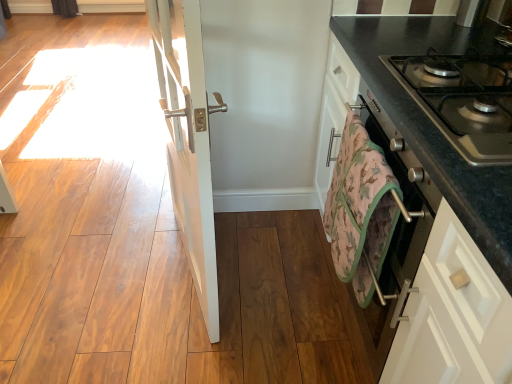
Question: Should I look upward or downward to see camouflage-patterned towel at lower right?

Choices:
 (A) up
 (B) down

Answer: (B)

Question: Considering the relative positions of white glossy door at center and black granite countertop at right in the image provided, is white glossy door at center to the left of black granite countertop at right from the viewer's perspective?

Choices:
 (A) yes
 (B) no

Answer: (A)

Question: Is white glossy door at center further to camera compared to black granite countertop at right?

Choices:
 (A) no
 (B) yes

Answer: (B)

Question: Is white glossy door at center to the right of black granite countertop at right from the viewer's perspective?

Choices:
 (A) yes
 (B) no

Answer: (B)

Question: Would you say black granite countertop at right is part of white glossy door at center's contents?

Choices:
 (A) no
 (B) yes

Answer: (A)

Question: Is white glossy door at center aimed at black granite countertop at right?

Choices:
 (A) no
 (B) yes

Answer: (A)

Question: From a real-world perspective, is white glossy door at center over black granite countertop at right?

Choices:
 (A) no
 (B) yes

Answer: (B)

Question: From the image's perspective, would you say camouflage-patterned towel at lower right is positioned over white glossy door at center?

Choices:
 (A) yes
 (B) no

Answer: (B)

Question: Can you confirm if camouflage-patterned towel at lower right is positioned to the left of white glossy door at center?

Choices:
 (A) no
 (B) yes

Answer: (A)

Question: From a real-world perspective, is camouflage-patterned towel at lower right under white glossy door at center?

Choices:
 (A) yes
 (B) no

Answer: (A)

Question: Is camouflage-patterned towel at lower right beside white glossy door at center?

Choices:
 (A) no
 (B) yes

Answer: (A)

Question: Considering the relative positions of camouflage-patterned towel at lower right and white glossy door at center in the image provided, is camouflage-patterned towel at lower right behind white glossy door at center?

Choices:
 (A) no
 (B) yes

Answer: (B)

Question: From the image's perspective, is camouflage-patterned towel at lower right located beneath white glossy door at center?

Choices:
 (A) no
 (B) yes

Answer: (B)

Question: Is camouflage-patterned towel at lower right completely or partially inside metallic gray gas stove at right?

Choices:
 (A) no
 (B) yes

Answer: (A)